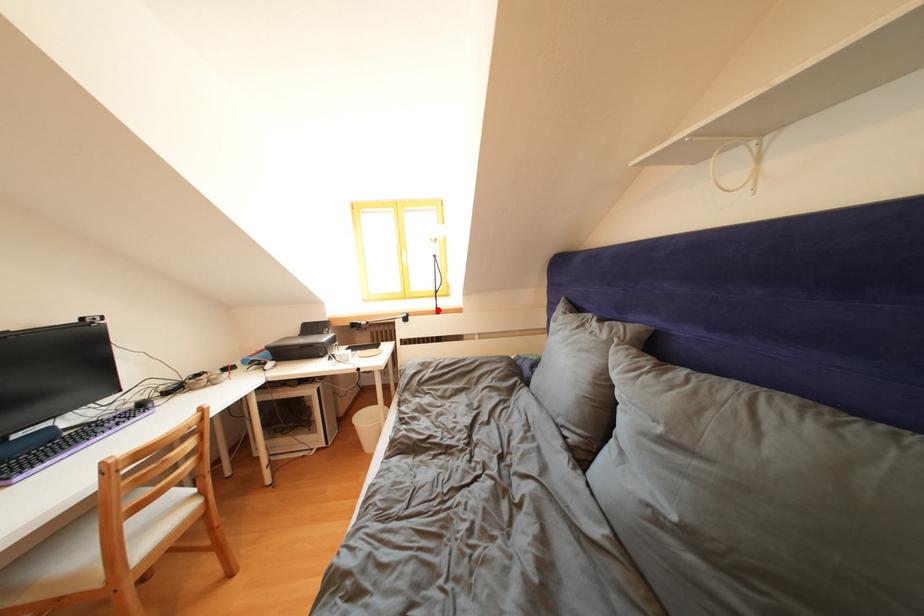
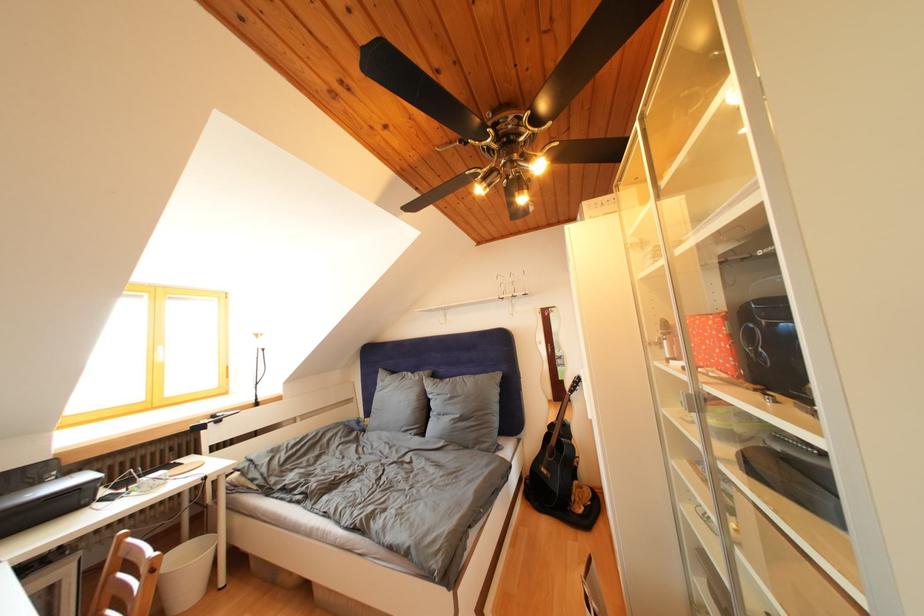
The point at the highlighted location is marked in the first image. Where is the corresponding point in the second image?

(257, 403)